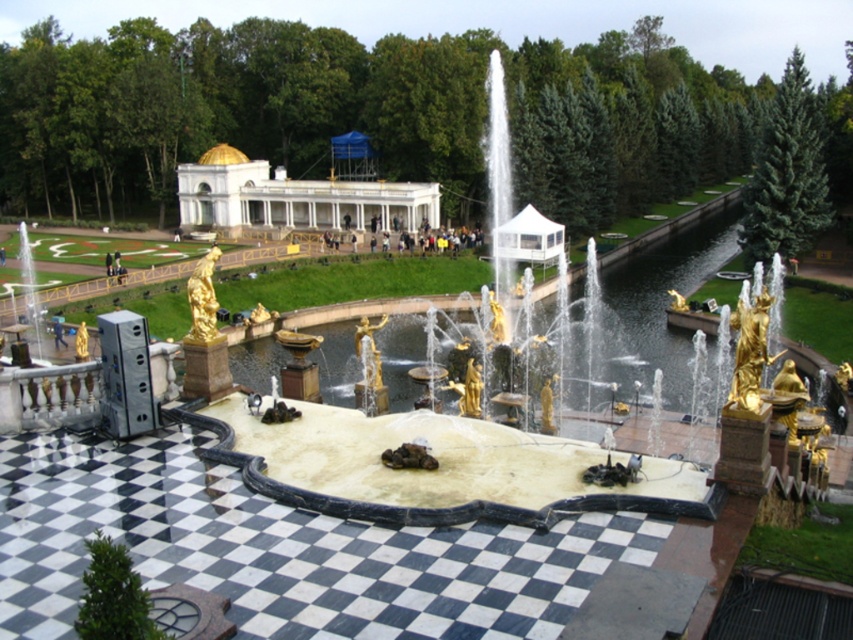
Question: Which of the following is the farthest from the observer?

Choices:
 (A) (277, 202)
 (B) (224, 413)

Answer: (A)

Question: Does gold statue fountain at center have a smaller size compared to white marble palace at center?

Choices:
 (A) yes
 (B) no

Answer: (B)

Question: Which object is farther from the camera taking this photo?

Choices:
 (A) gold statue fountain at center
 (B) white marble palace at center

Answer: (B)

Question: Can you confirm if gold statue fountain at center is positioned to the left of white marble palace at center?

Choices:
 (A) yes
 (B) no

Answer: (B)

Question: In this image, where is gold statue fountain at center located relative to white marble palace at center?

Choices:
 (A) below
 (B) above

Answer: (A)